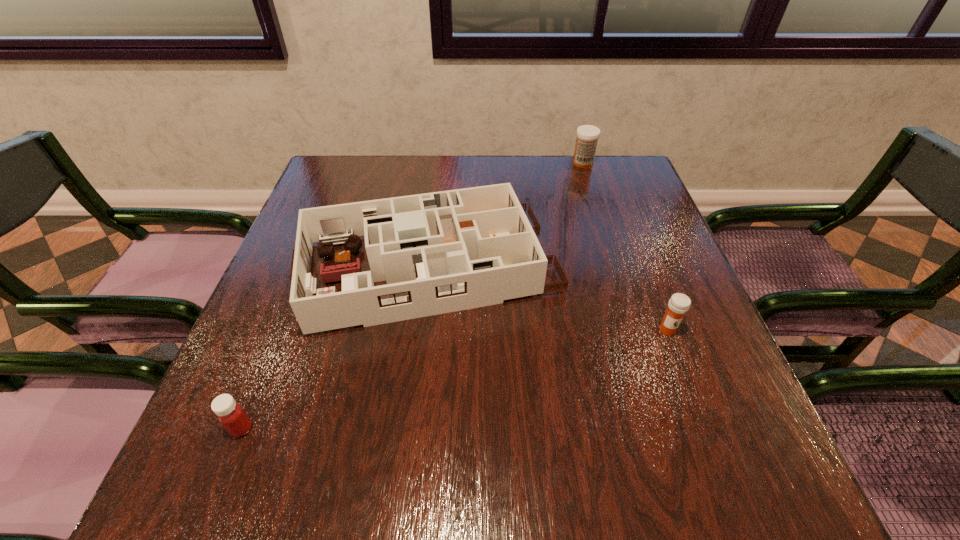
The image size is (960, 540). Identify the location of the second object from right to left. (587, 136).

What are the coordinates of `the farthest medicine` in the screenshot? It's located at (587, 136).

This screenshot has width=960, height=540. Identify the location of dollhouse. (440, 252).

Where is `the rightmost object`? The height and width of the screenshot is (540, 960). the rightmost object is located at coordinates (679, 304).

The width and height of the screenshot is (960, 540). I want to click on the second nearest medicine, so click(x=679, y=304).

Find the location of a particular element. the nearest object is located at coordinates (231, 415).

Locate an element on the screen. This screenshot has height=540, width=960. the nearest medicine is located at coordinates (231, 415).

You are a GUI agent. You are given a task and a screenshot of the screen. Output one action in this format:
    pyautogui.click(x=<x>, y=<y>)
    Task: Click on the vacant space located on the left of the third object from left to right
    The width and height of the screenshot is (960, 540).
    Given the screenshot: What is the action you would take?
    pyautogui.click(x=535, y=163)

The height and width of the screenshot is (540, 960). Find the location of `free spot located on the back of the dollhouse`. free spot located on the back of the dollhouse is located at coordinates (438, 190).

Identify the location of vacant space situated on the label side of the rightmost medicine. (699, 413).